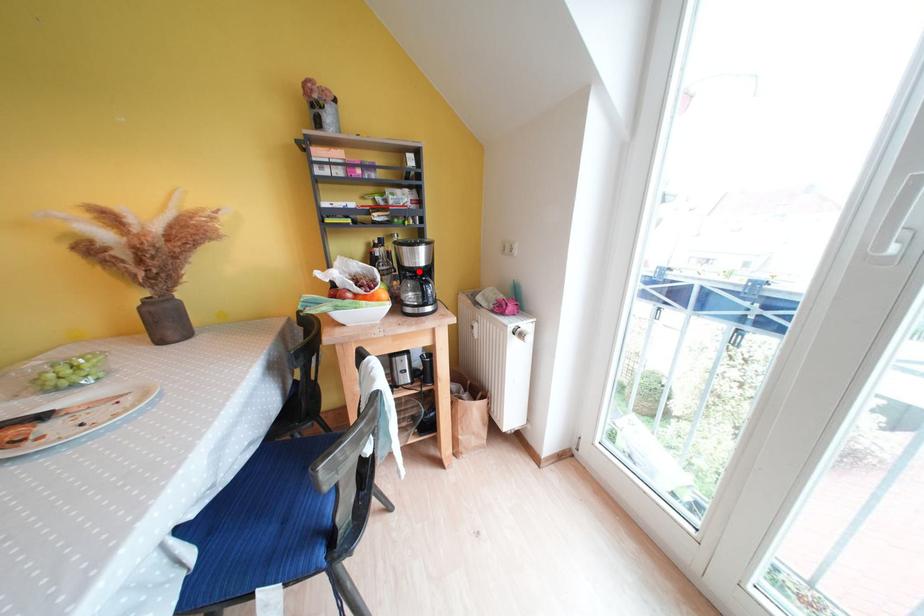
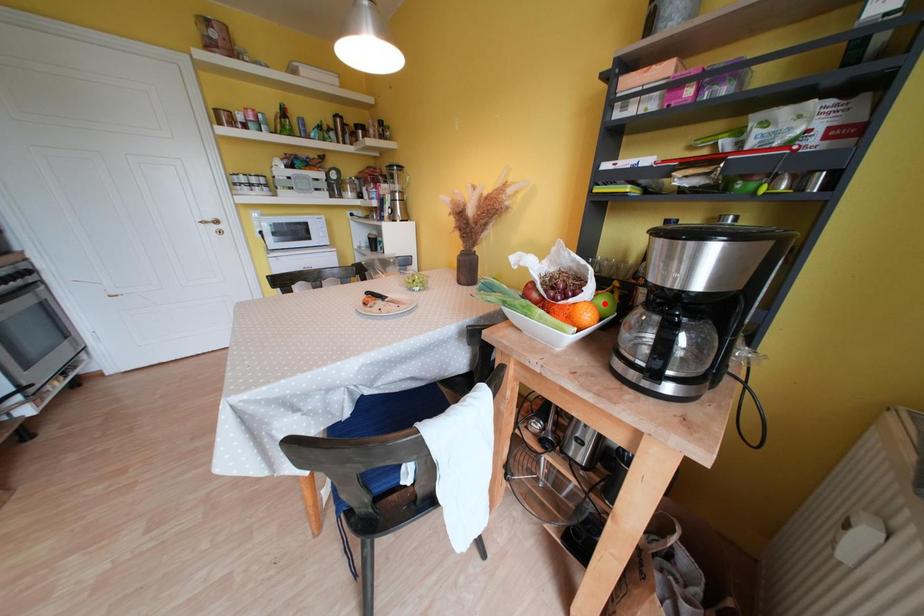
I am providing you with two images of the same scene from different viewpoints. A red point is marked on the first image and another point is marked on the second image. Is the marked point in image1 the same physical position as the marked point in image2?

No